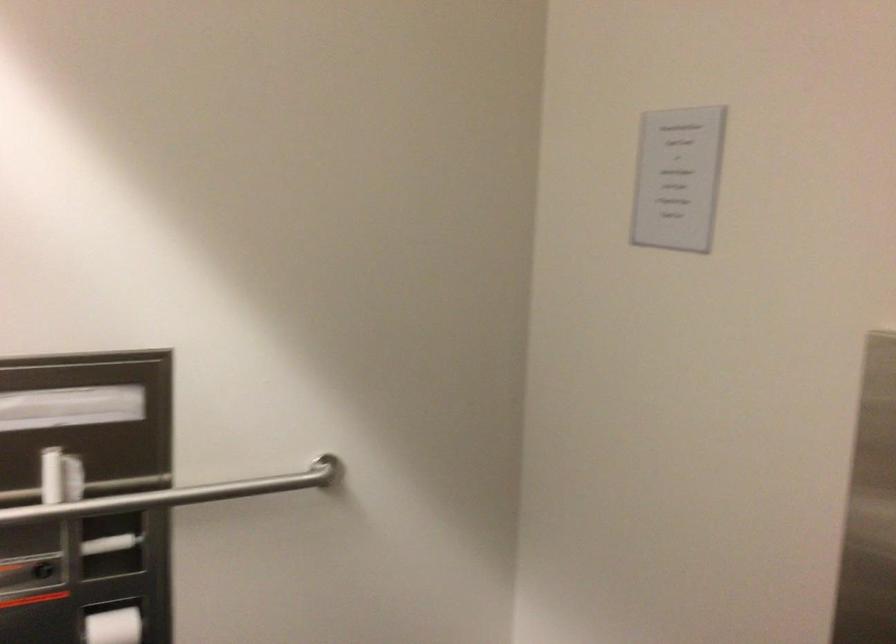
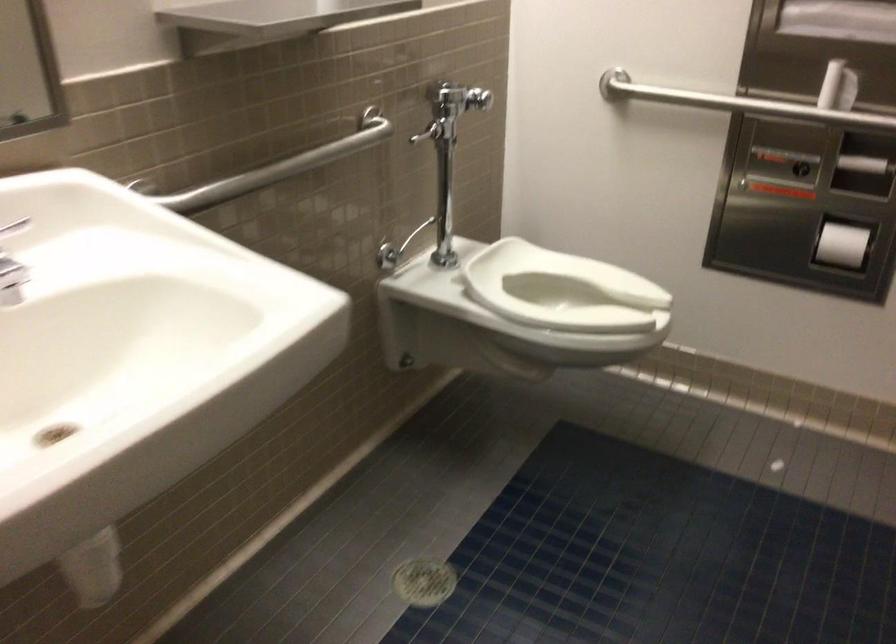
Locate, in the second image, the point that corresponds to point (76, 480) in the first image.

(838, 87)